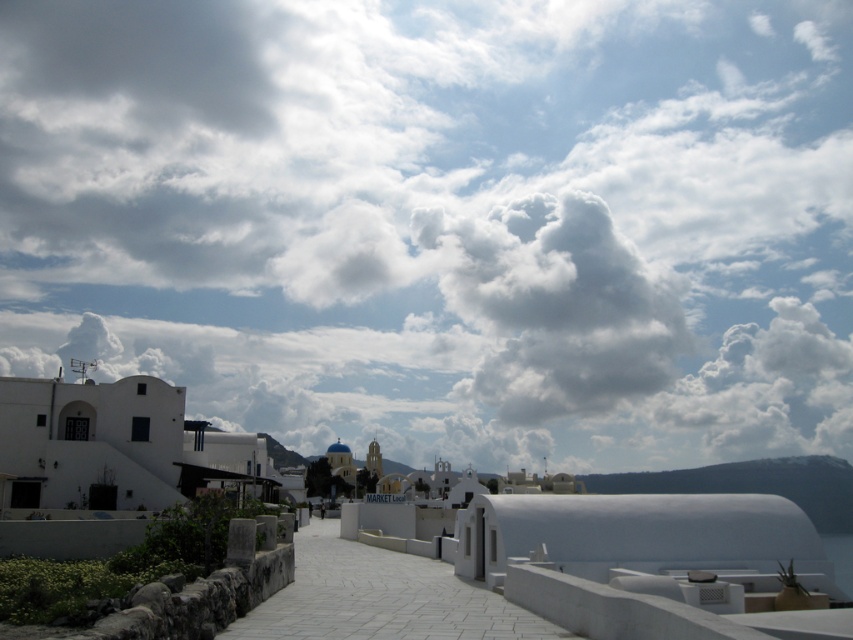
You are a tourist standing at the entrance of the coastal town and want to take a photo of the white fluffy cloud at upper center and the white stone path at center. Which object appears closer to you in the photo?

The white fluffy cloud at upper center appears closer to you in the photo because it is further to the viewer than the white stone path at center.

You are an architect designing a new building in the coastal town. You want to place a new statue exactly at the midpoint between the white fluffy cloud at upper center and the blue dome building in the midground. What are the coordinates of this midpoint?

The midpoint between the white fluffy cloud at upper center at point (444, 220) and the blue dome building in the midground would be calculated by averaging their coordinates. However, the coordinates for the blue dome building in the midground are not provided in the scene description. Please provide the coordinates of the blue dome building in the midground to calculate the midpoint.

You are standing at the point marked by coordinates point (444, 220) in the coastal town scene. What object is located exactly at that point?

The white fluffy cloud at upper center is located exactly at point (444, 220).